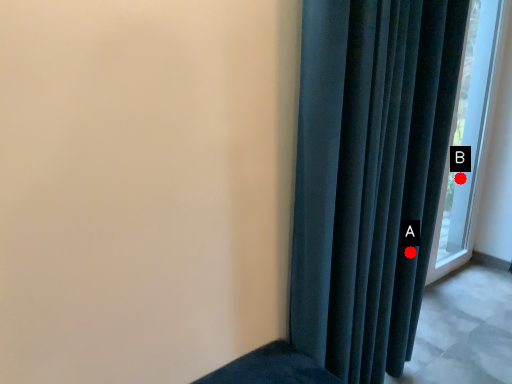
Question: Two points are circled on the image, labeled by A and B beside each circle. Among these points, which one is farthest from the camera?

Choices:
 (A) A is further
 (B) B is further

Answer: (B)